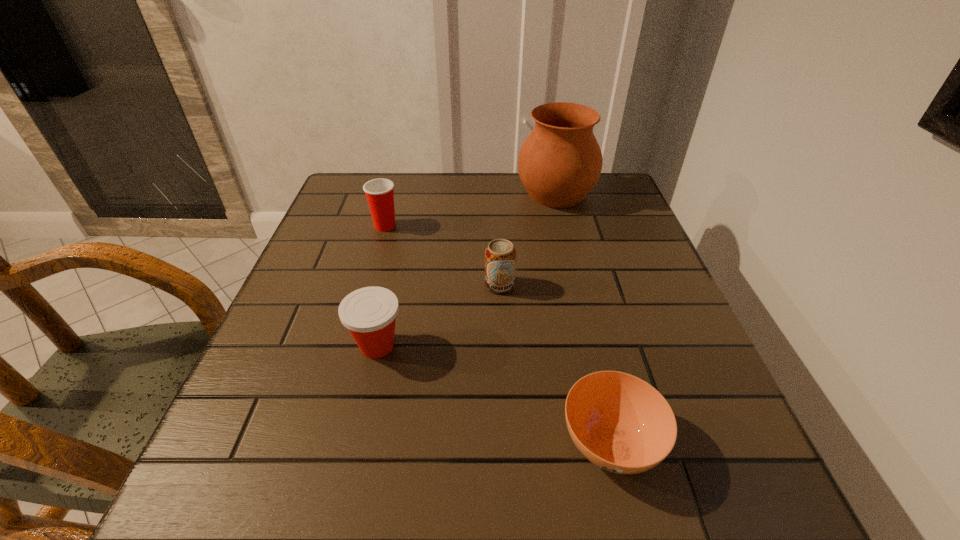
Locate an element on the screen. This screenshot has width=960, height=540. vacant area in the image that satisfies the following two spatial constraints: 1. on the front side of the farther Dixie cup; 2. on the left side of the shortest object is located at coordinates [x=324, y=442].

The height and width of the screenshot is (540, 960). Find the location of `free space that satisfies the following two spatial constraints: 1. on the front side of the farther Dixie cup; 2. on the right side of the beer can`. free space that satisfies the following two spatial constraints: 1. on the front side of the farther Dixie cup; 2. on the right side of the beer can is located at coordinates (369, 285).

Locate an element on the screen. vacant region that satisfies the following two spatial constraints: 1. on the front side of the fourth farthest object; 2. on the right side of the soup bowl is located at coordinates (355, 442).